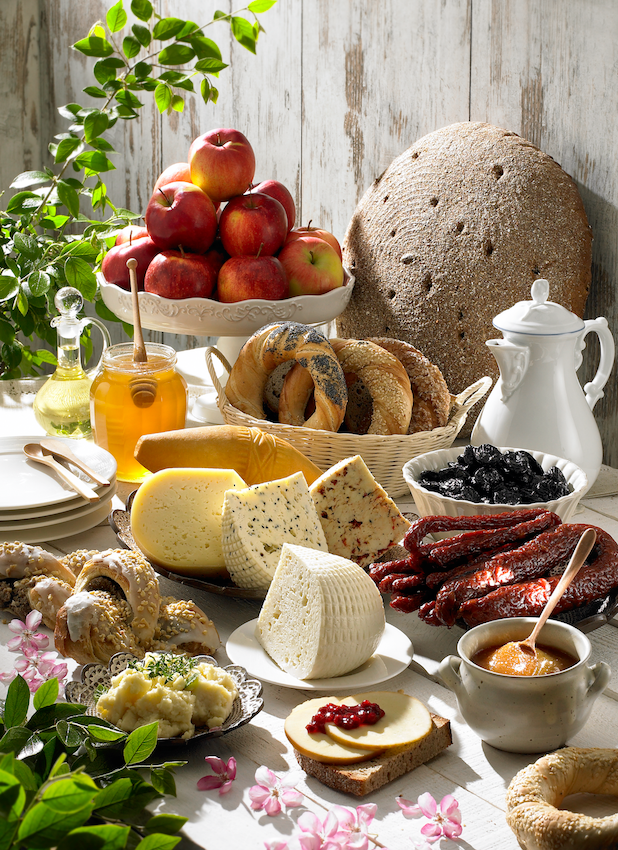
The image size is (618, 850). I want to click on wicker basket, so click(379, 459).